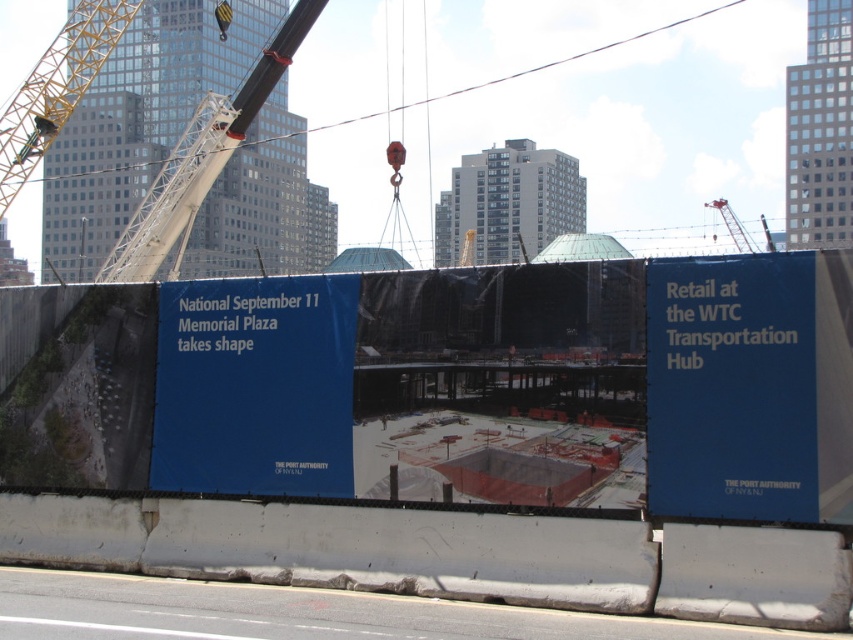
Question: Can you confirm if blue fabric construction site at center is positioned to the left of blue fabric sign at center?

Choices:
 (A) yes
 (B) no

Answer: (B)

Question: Which object is farther from the camera taking this photo?

Choices:
 (A) blue fabric sign at center
 (B) blue paper at upper right
 (C) blue fabric construction site at center
 (D) metallic gray crane at upper left

Answer: (D)

Question: Does blue paper at upper right appear over blue fabric sign at center?

Choices:
 (A) no
 (B) yes

Answer: (B)

Question: Is blue fabric construction site at center positioned in front of blue paper at upper right?

Choices:
 (A) yes
 (B) no

Answer: (B)

Question: Considering the real-world distances, which object is closest to the blue fabric construction site at center?

Choices:
 (A) metallic gray crane at upper left
 (B) blue fabric sign at center
 (C) blue paper at upper right

Answer: (C)

Question: Which object is closer to the camera taking this photo?

Choices:
 (A) blue fabric sign at center
 (B) blue paper at upper right
 (C) blue fabric construction site at center
 (D) metallic gray crane at upper left

Answer: (B)